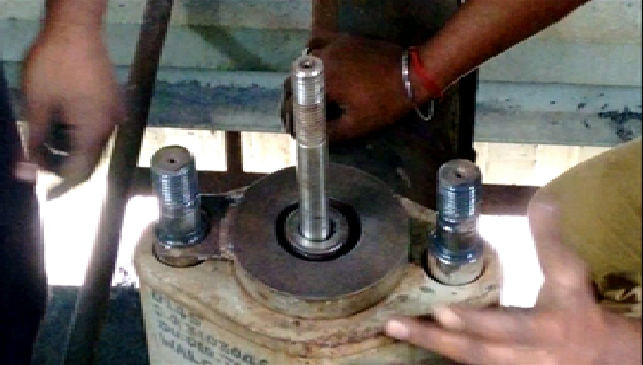
This screenshot has width=643, height=365. Identify the location of white wall. (206, 55).